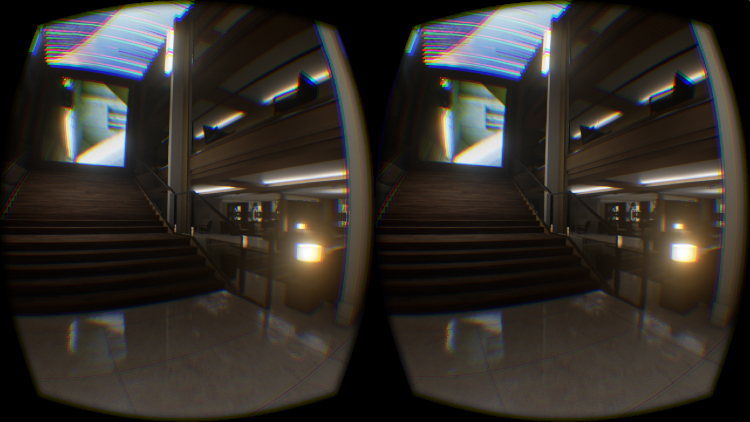
Where is `yellow light`? The height and width of the screenshot is (422, 750). yellow light is located at coordinates (300, 250).